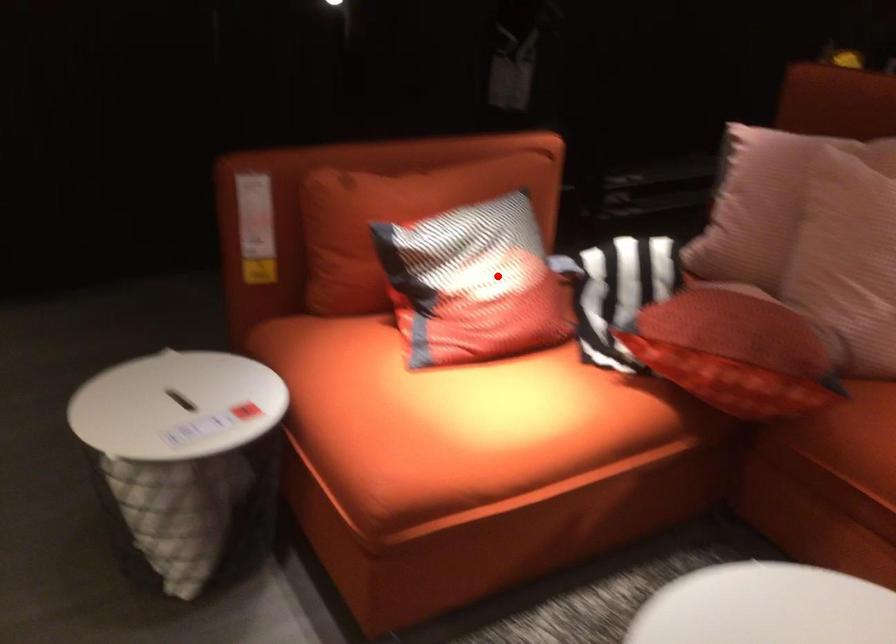
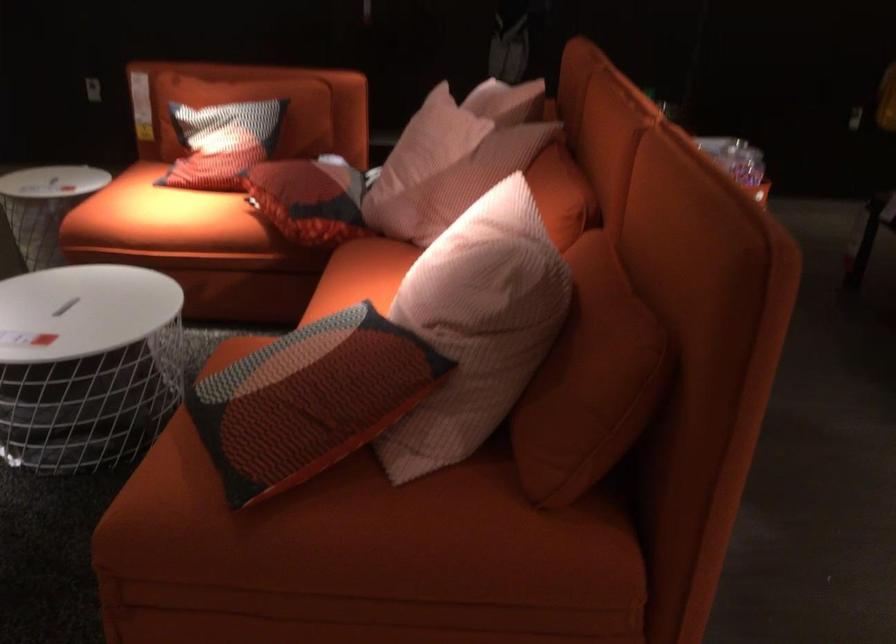
Question: A red point is marked in image1. In image2, is the corresponding 3D point closer to the camera or farther? Reply with the corresponding letter.

Choices:
 (A) The corresponding 3D point is closer.
 (B) The corresponding 3D point is farther.

Answer: (B)